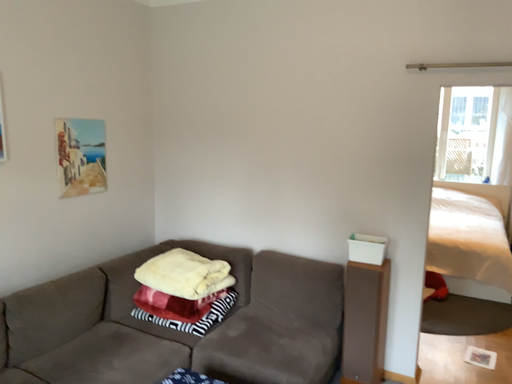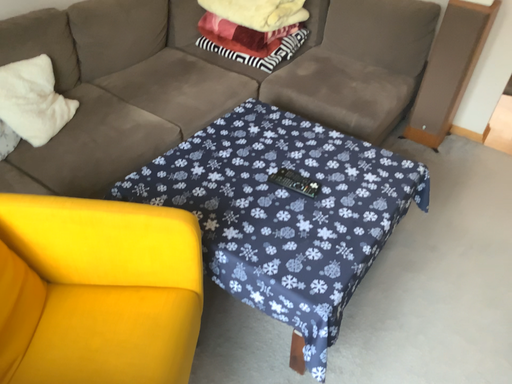
Question: How did the camera likely rotate when shooting the video?

Choices:
 (A) rotated left
 (B) rotated right

Answer: (A)